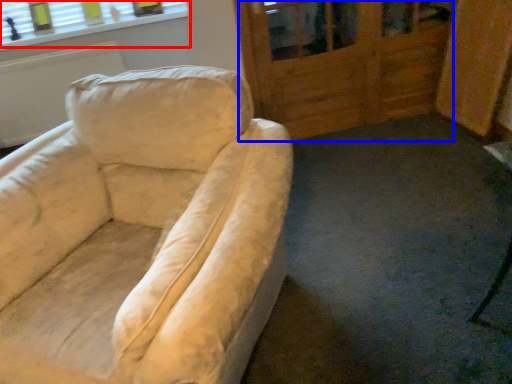
Question: Which of the following is the farthest to the observer, window (highlighted by a red box) or screen door (highlighted by a blue box)?

Choices:
 (A) window
 (B) screen door

Answer: (A)